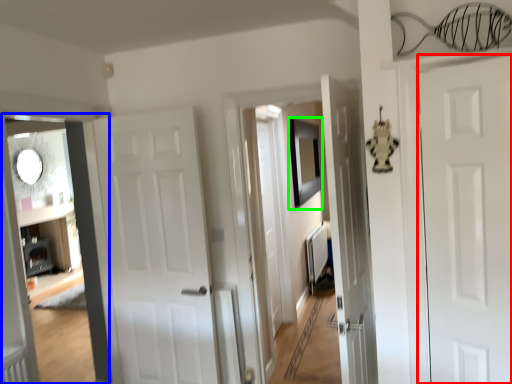
Question: Which object is the closest to the door (highlighted by a red box)? Choose among these: corridor (highlighted by a blue box) or picture frame (highlighted by a green box).

Choices:
 (A) corridor
 (B) picture frame

Answer: (A)